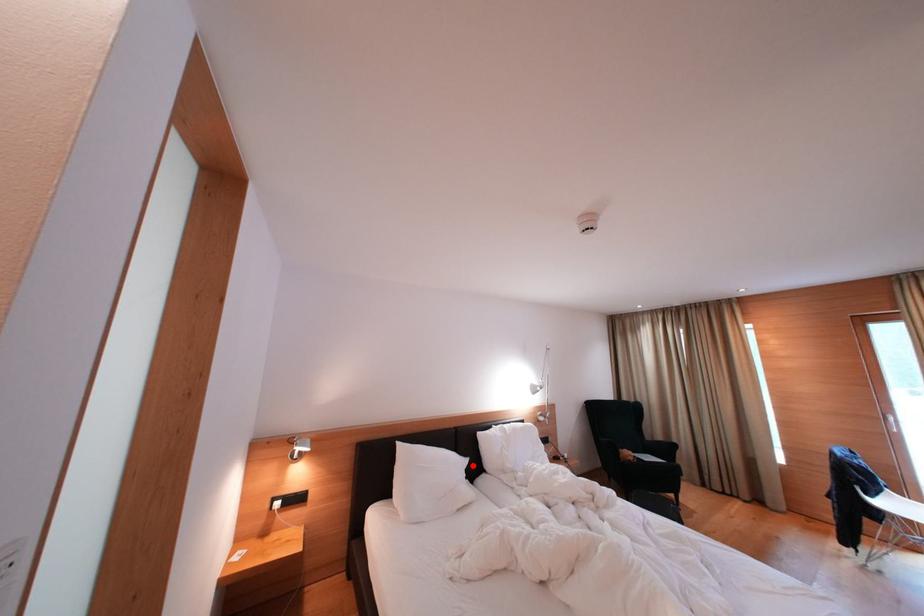
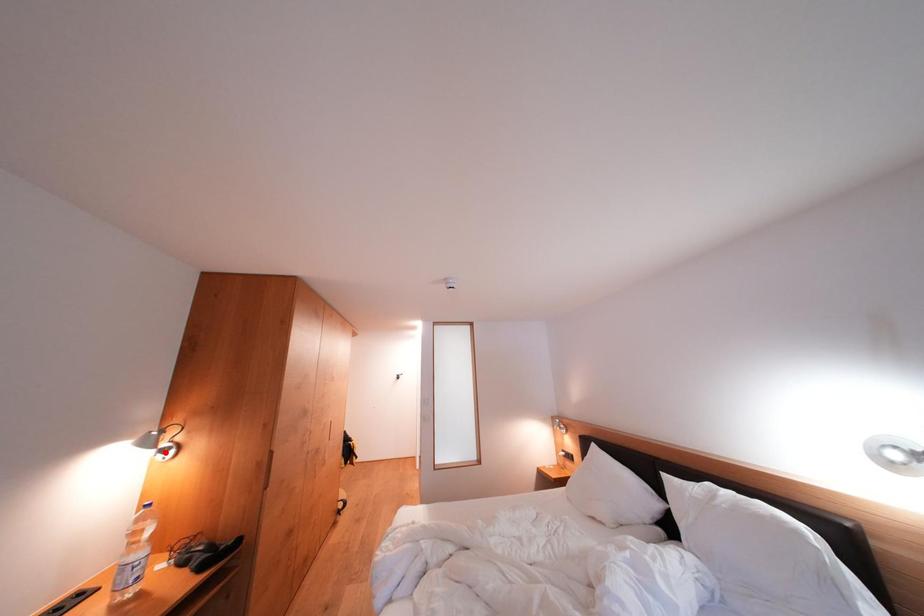
I am providing you with two images of the same scene from different viewpoints. A red point is marked on the first image and another point is marked on the second image. Do the highlighted points in image1 and image2 indicate the same real-world spot?

No